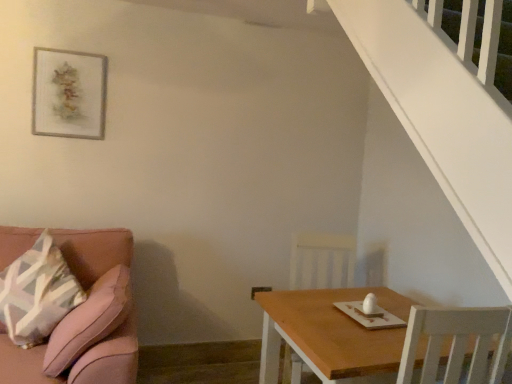
Question: In the image, is wooden chair at lower right positioned in front of or behind wooden picture frame at upper left?

Choices:
 (A) behind
 (B) front

Answer: (B)

Question: Based on their positions, is wooden chair at lower right located to the left or right of wooden picture frame at upper left?

Choices:
 (A) left
 (B) right

Answer: (B)

Question: Which of these objects is positioned farthest from the pink fabric couch at left?

Choices:
 (A) wooden chair at lower right
 (B) wooden picture frame at upper left
 (C) wooden table at lower right

Answer: (A)

Question: Considering the real-world distances, which object is closest to the pink fabric couch at left?

Choices:
 (A) wooden table at lower right
 (B) wooden picture frame at upper left
 (C) wooden chair at lower right

Answer: (A)